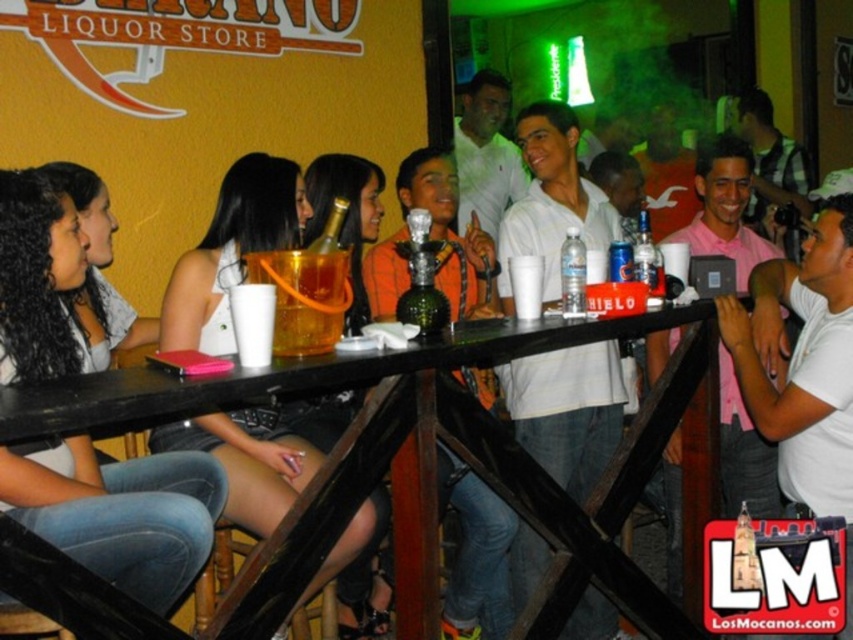
Question: Which object is farther from the camera taking this photo?

Choices:
 (A) denim jeans at lower left
 (B) matte black phone at center
 (C) black matte table at center
 (D) translucent plastic cup at center

Answer: (B)

Question: Which of the following is the closest to the observer?

Choices:
 (A) (560, 257)
 (B) (227, 468)
 (C) (148, 500)
 (D) (340, 468)

Answer: (D)

Question: Is denim jeans at lower left thinner than matte black phone at center?

Choices:
 (A) no
 (B) yes

Answer: (B)

Question: Among these points, which one is nearest to the camera?

Choices:
 (A) (560, 284)
 (B) (525, 566)

Answer: (A)

Question: Does white matte shirt at center have a smaller size compared to clear plastic bottle at bar center?

Choices:
 (A) yes
 (B) no

Answer: (B)

Question: Observing the image, what is the correct spatial positioning of denim jeans at lower left in reference to translucent plastic cup at center?

Choices:
 (A) above
 (B) below

Answer: (B)